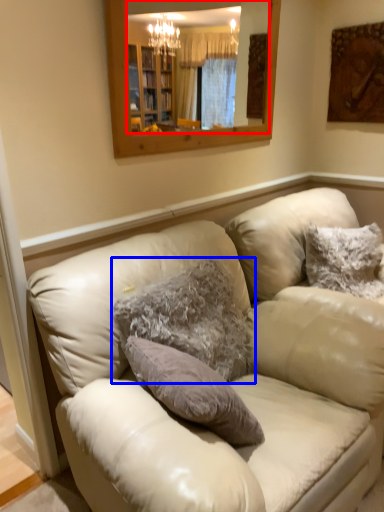
Question: Which point is closer to the camera, mirror (highlighted by a red box) or pillow (highlighted by a blue box)?

Choices:
 (A) mirror
 (B) pillow

Answer: (B)